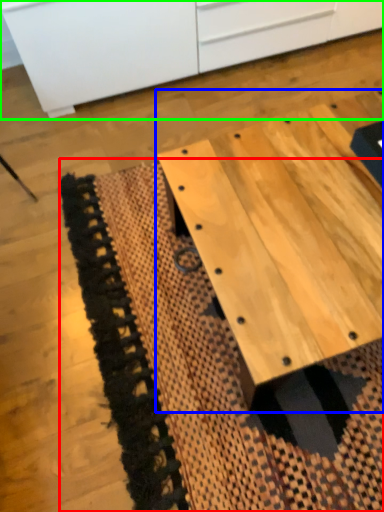
Question: Which is farther away from mat (highlighted by a red box)? table (highlighted by a blue box) or cabinetry (highlighted by a green box)?

Choices:
 (A) table
 (B) cabinetry

Answer: (B)